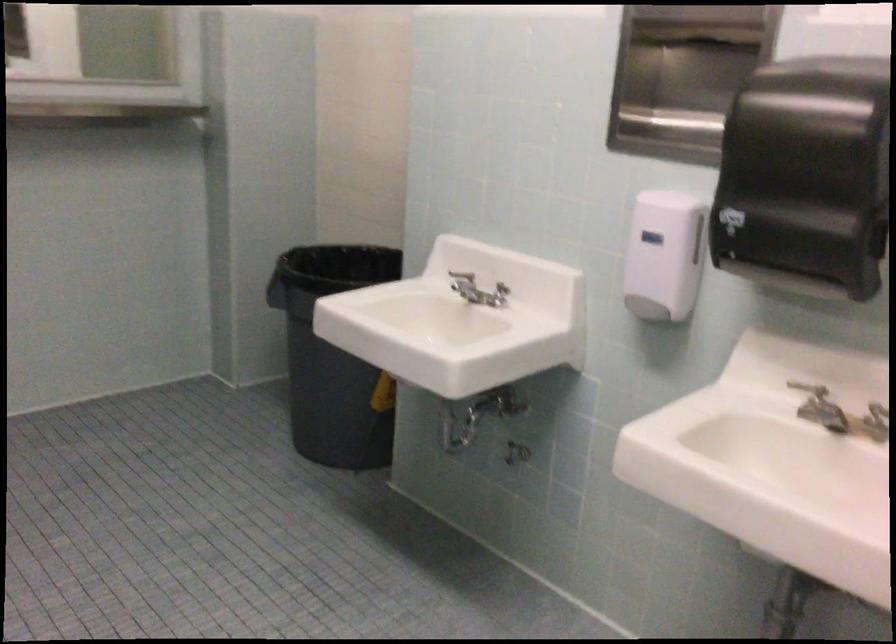
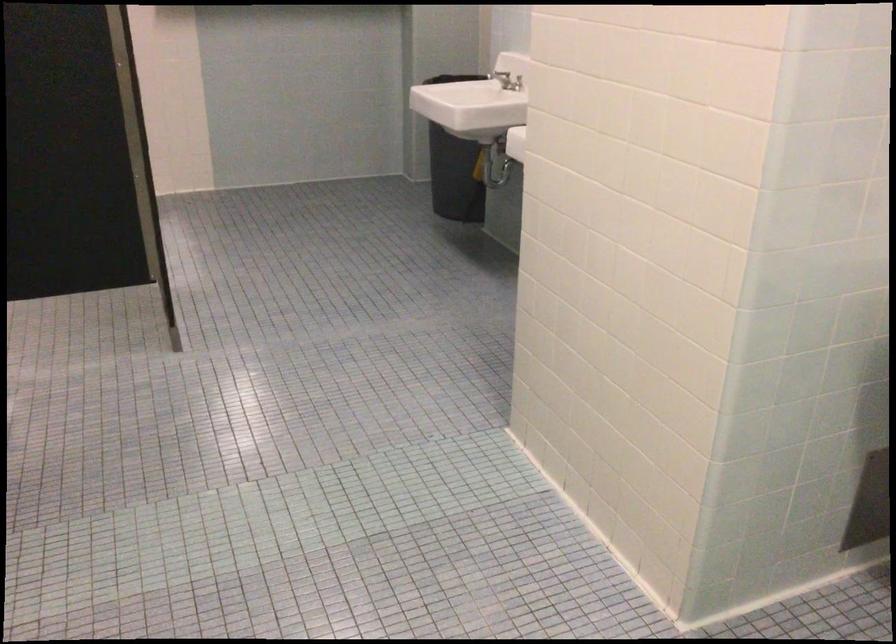
Where in the second image is the point corresponding to (440,281) from the first image?

(500, 75)